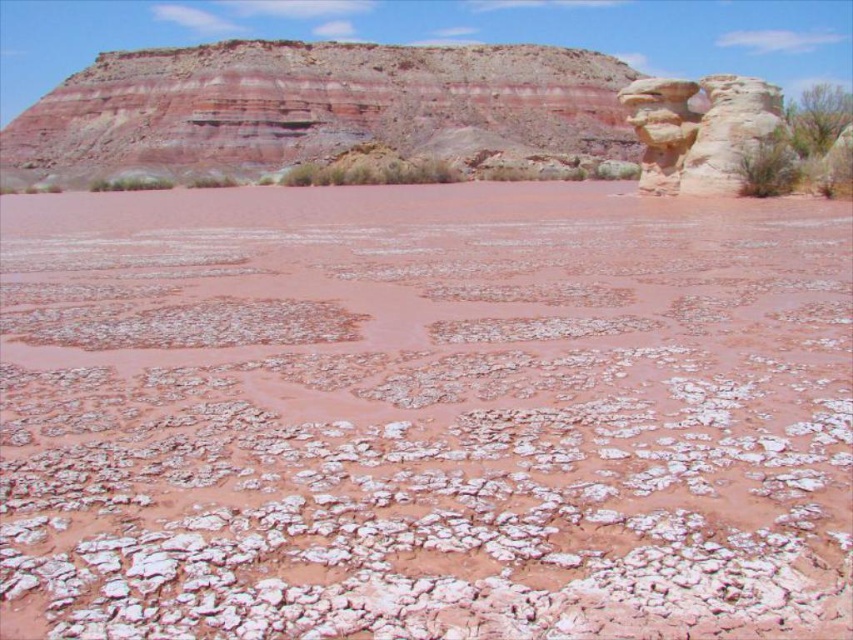
Question: Which of the following is the closest to the observer?

Choices:
 (A) (705, 163)
 (B) (241, 372)

Answer: (B)

Question: Can you confirm if dried mud at center is wider than smooth sandstone rock formation at upper right?

Choices:
 (A) yes
 (B) no

Answer: (A)

Question: Does dried mud at center have a smaller size compared to smooth sandstone rock formation at upper right?

Choices:
 (A) yes
 (B) no

Answer: (B)

Question: Which point is closer to the camera taking this photo?

Choices:
 (A) (695, 115)
 (B) (374, 232)

Answer: (B)

Question: Is dried mud at center in front of smooth sandstone rock formation at upper right?

Choices:
 (A) no
 (B) yes

Answer: (B)